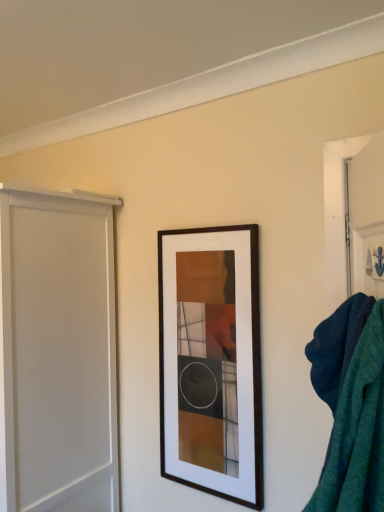
Question: Does white matte screen door at left turn towards teal fabric bath towel at right?

Choices:
 (A) no
 (B) yes

Answer: (A)

Question: Does white matte screen door at left come in front of teal fabric bath towel at right?

Choices:
 (A) no
 (B) yes

Answer: (A)

Question: Can we say white matte screen door at left lies outside teal fabric bath towel at right?

Choices:
 (A) no
 (B) yes

Answer: (B)

Question: Is white matte screen door at left to the right of teal fabric bath towel at right from the viewer's perspective?

Choices:
 (A) yes
 (B) no

Answer: (B)

Question: Can you confirm if white matte screen door at left is thinner than teal fabric bath towel at right?

Choices:
 (A) no
 (B) yes

Answer: (A)

Question: Is white matte screen door at left bigger or smaller than teal fabric bath towel at right?

Choices:
 (A) small
 (B) big

Answer: (B)

Question: From the image's perspective, relative to teal fabric bath towel at right, is white matte screen door at left above or below?

Choices:
 (A) above
 (B) below

Answer: (B)

Question: In terms of height, does white matte screen door at left look taller or shorter compared to teal fabric bath towel at right?

Choices:
 (A) tall
 (B) short

Answer: (A)

Question: In the image, is white matte screen door at left positioned in front of or behind teal fabric bath towel at right?

Choices:
 (A) front
 (B) behind

Answer: (B)

Question: Considering the positions of point (322, 392) and point (92, 389), is point (322, 392) closer or farther from the camera than point (92, 389)?

Choices:
 (A) farther
 (B) closer

Answer: (B)

Question: Do you think teal fabric bath towel at right is within white matte screen door at left, or outside of it?

Choices:
 (A) inside
 (B) outside

Answer: (B)

Question: Is teal fabric bath towel at right in front of or behind white matte screen door at left in the image?

Choices:
 (A) front
 (B) behind

Answer: (A)

Question: In terms of height, does teal fabric bath towel at right look taller or shorter compared to white matte screen door at left?

Choices:
 (A) tall
 (B) short

Answer: (B)

Question: Choose the correct answer: Is wooden picture frame at center inside teal fabric bath towel at right or outside it?

Choices:
 (A) outside
 (B) inside

Answer: (A)

Question: In the image, is wooden picture frame at center on the left side or the right side of teal fabric bath towel at right?

Choices:
 (A) left
 (B) right

Answer: (A)